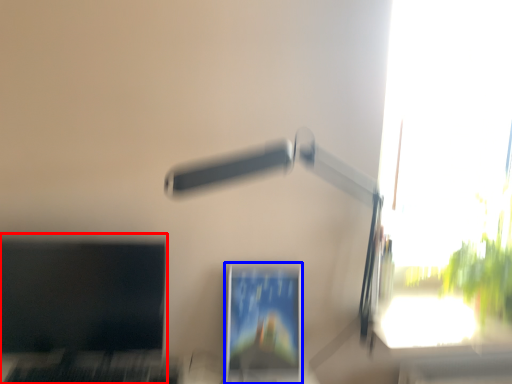
Question: Which object appears farthest to the camera in this image, computer monitor (highlighted by a red box) or computer monitor (highlighted by a blue box)?

Choices:
 (A) computer monitor
 (B) computer monitor

Answer: (B)